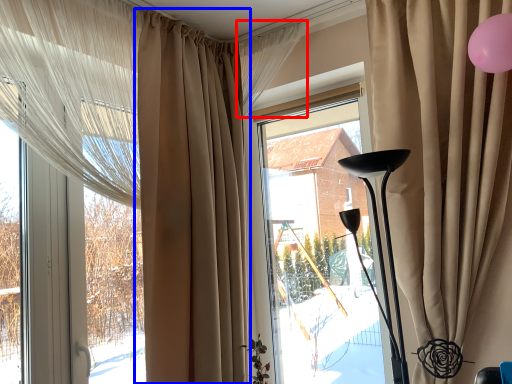
Question: Which of the following is the farthest to the observer, curtain (highlighted by a red box) or curtain (highlighted by a blue box)?

Choices:
 (A) curtain
 (B) curtain

Answer: (A)